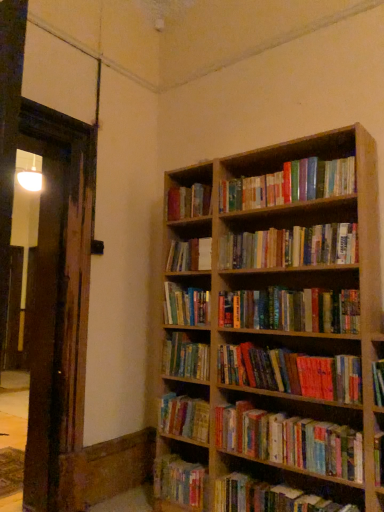
Describe the element at coordinates (185, 357) in the screenshot. This screenshot has height=512, width=384. I see `hardcover books at center, the fifth book positioned from the bottom` at that location.

Where is `hardcover books at center, which is the eighth book from top to bottom`? The width and height of the screenshot is (384, 512). hardcover books at center, which is the eighth book from top to bottom is located at coordinates (185, 357).

What do you see at coordinates (186, 305) in the screenshot?
I see `hardcover book at center, which ranks as the seventh book in bottom-to-top order` at bounding box center [186, 305].

From the picture: Measure the distance between point (282, 488) and camera.

6.74 feet.

Where is `multicolored paperbacks at center, which ranks as the 3th book in bottom-to-top order`? multicolored paperbacks at center, which ranks as the 3th book in bottom-to-top order is located at coordinates (184, 417).

Locate an element on the screen. hardcover books at center, the fifth book positioned from the bottom is located at coordinates (185, 357).

Considering the relative sizes of hardcover book at center, positioned as the 6th book in top-to-bottom order, and hardcover book at lower center, the 12th book when ordered from top to bottom, in the image provided, is hardcover book at center, positioned as the 6th book in top-to-bottom order, thinner than hardcover book at lower center, the 12th book when ordered from top to bottom,?

Yes, hardcover book at center, positioned as the 6th book in top-to-bottom order, is thinner than hardcover book at lower center, the 12th book when ordered from top to bottom.

From the image's perspective, is hardcover book at center, positioned as the 6th book in top-to-bottom order, over hardcover book at lower center, the 12th book when ordered from top to bottom?

Correct, hardcover book at center, positioned as the 6th book in top-to-bottom order, appears higher than hardcover book at lower center, the 12th book when ordered from top to bottom, in the image.

Does hardcover book at center, which ranks as the seventh book in bottom-to-top order, have a larger size compared to hardcover book at lower center, the first book when ordered from bottom to top?

Yes, hardcover book at center, which ranks as the seventh book in bottom-to-top order, is bigger than hardcover book at lower center, the first book when ordered from bottom to top.

Which object is further away from the camera taking this photo, hardcover book at center, which ranks as the seventh book in bottom-to-top order, or hardcover book at lower center, the first book when ordered from bottom to top?

hardcover book at center, which ranks as the seventh book in bottom-to-top order, is more distant.

From a real-world perspective, is multicolored paperbacks at center, which appears as the fourth book when ordered from the bottom, beneath multicolored paperbacks at upper center, the twelfth book in the bottom-to-top sequence?

Yes, from a real-world perspective, multicolored paperbacks at center, which appears as the fourth book when ordered from the bottom, is below multicolored paperbacks at upper center, the twelfth book in the bottom-to-top sequence.

What's the angular difference between multicolored paperbacks at center, the 9th book positioned from the top, and multicolored paperbacks at upper center, which is the first book in top-to-bottom order,'s facing directions?

multicolored paperbacks at center, the 9th book positioned from the top, and multicolored paperbacks at upper center, which is the first book in top-to-bottom order, are facing 0.00344 degrees away from each other.

Does point (276, 461) come closer to viewer compared to point (308, 199)?

Yes, it is in front of point (308, 199).

Could you tell me if multicolored paperbacks at center, which appears as the fourth book when ordered from the bottom, is facing multicolored paperbacks at upper center, which is the first book in top-to-bottom order?

No, multicolored paperbacks at center, which appears as the fourth book when ordered from the bottom, does not turn towards multicolored paperbacks at upper center, which is the first book in top-to-bottom order.

Is hardcover books at center, placed as the fifth book when sorted from top to bottom, next to multicolored paperbacks at center, which ranks as the 3th book in bottom-to-top order, and touching it?

No, hardcover books at center, placed as the fifth book when sorted from top to bottom, is not making contact with multicolored paperbacks at center, which ranks as the 3th book in bottom-to-top order.

The image size is (384, 512). I want to click on the 4th book behind the hardcover books at center, the eighth book when ordered from bottom to top, counting from the anchor's position, so pyautogui.click(x=184, y=417).

Can you confirm if hardcover books at center, placed as the fifth book when sorted from top to bottom, is smaller than multicolored paperbacks at center, which ranks as the 3th book in bottom-to-top order?

No.

In the scene shown: Which object is thinner, hardcover books at center, the eighth book when ordered from bottom to top, or multicolored paperbacks at center, the tenth book from the top?

hardcover books at center, the eighth book when ordered from bottom to top, is thinner.

Does point (230, 205) appear closer or farther from the camera than point (179, 289)?

Point (230, 205).

Considering the relative sizes of multicolored paperbacks at upper center, which is the first book in top-to-bottom order, and hardcover book at center, which ranks as the seventh book in bottom-to-top order, in the image provided, is multicolored paperbacks at upper center, which is the first book in top-to-bottom order, taller than hardcover book at center, which ranks as the seventh book in bottom-to-top order,?

In fact, multicolored paperbacks at upper center, which is the first book in top-to-bottom order, may be shorter than hardcover book at center, which ranks as the seventh book in bottom-to-top order.

Can you confirm if multicolored paperbacks at upper center, which is the first book in top-to-bottom order, is thinner than hardcover book at center, positioned as the 6th book in top-to-bottom order?

Yes, multicolored paperbacks at upper center, which is the first book in top-to-bottom order, is thinner than hardcover book at center, positioned as the 6th book in top-to-bottom order.

Which object is further away from the camera taking this photo, multicolored paperbacks at upper center, which is the first book in top-to-bottom order, or hardcover book at center, positioned as the 6th book in top-to-bottom order?

Positioned behind is hardcover book at center, positioned as the 6th book in top-to-bottom order.

Is hardcover book at center, positioned as the 6th book in top-to-bottom order, to the left or to the right of hardcover books at center, the third book from the top, in the image?

hardcover book at center, positioned as the 6th book in top-to-bottom order, is positioned on hardcover books at center, the third book from the top,'s left side.

From the image's perspective, between hardcover book at center, positioned as the 6th book in top-to-bottom order, and hardcover books at center, which ranks as the tenth book in bottom-to-top order, which one is located above?

hardcover books at center, which ranks as the tenth book in bottom-to-top order.

Which object is closer to the camera taking this photo, hardcover books at center, placed as the fifth book when sorted from top to bottom, or hardcover books at center, the third book from the top?

hardcover books at center, placed as the fifth book when sorted from top to bottom, is in front.

Can you confirm if hardcover books at center, placed as the fifth book when sorted from top to bottom, is wider than hardcover books at center, the third book from the top?

Correct, the width of hardcover books at center, placed as the fifth book when sorted from top to bottom, exceeds that of hardcover books at center, the third book from the top.

From the image's perspective, is hardcover books at center, the eighth book when ordered from bottom to top, on hardcover books at center, the third book from the top?

No, from the image's perspective, hardcover books at center, the eighth book when ordered from bottom to top, is not above hardcover books at center, the third book from the top.

Are hardcover books at center, the eighth book when ordered from bottom to top, and hardcover books at center, which ranks as the tenth book in bottom-to-top order, far apart?

Actually, hardcover books at center, the eighth book when ordered from bottom to top, and hardcover books at center, which ranks as the tenth book in bottom-to-top order, are a little close together.

Does point (223, 416) appear closer or farther from the camera than point (164, 360)?

Clearly, point (223, 416) is closer to the camera than point (164, 360).

Who is taller, multicolored paperbacks at center, which appears as the fourth book when ordered from the bottom, or hardcover books at center, which is the eighth book from top to bottom?

multicolored paperbacks at center, which appears as the fourth book when ordered from the bottom.

Looking at this image, from a real-world perspective, is multicolored paperbacks at center, which appears as the fourth book when ordered from the bottom, positioned above or below hardcover books at center, the fifth book positioned from the bottom?

multicolored paperbacks at center, which appears as the fourth book when ordered from the bottom, is situated lower than hardcover books at center, the fifth book positioned from the bottom, in the real world.

Considering the sizes of multicolored paperbacks at center, the 9th book positioned from the top, and hardcover books at center, which is the eighth book from top to bottom, in the image, is multicolored paperbacks at center, the 9th book positioned from the top, wider or thinner than hardcover books at center, which is the eighth book from top to bottom,?

In the image, multicolored paperbacks at center, the 9th book positioned from the top, appears to be wider than hardcover books at center, which is the eighth book from top to bottom.

From a real-world perspective, count 7th books upward from the hardcover book at lower center, the first book when ordered from bottom to top, and point to it. Please provide its 2D coordinates.

[(186, 305)]

This screenshot has height=512, width=384. I want to click on the 4th book in front when counting from the multicolored paperbacks at upper center, which is the first book in top-to-bottom order, so click(290, 441).

Estimate the real-world distances between objects in this image. Which object is further from multicolored paperbacks at upper center, which is the first book in top-to-bottom order, hardcover book at center, which is the 4th book in top-to-bottom order, or hardcover books at center, placed as the fifth book when sorted from top to bottom?

The object further to multicolored paperbacks at upper center, which is the first book in top-to-bottom order, is hardcover books at center, placed as the fifth book when sorted from top to bottom.

Based on their spatial positions, is hardcover books at upper center, which is counted as the 2th book, starting from the top, or hardcover book at lower right, arranged as the second book when ordered from the bottom, further from multicolored paperbacks at upper center, which is the first book in top-to-bottom order?

hardcover book at lower right, arranged as the second book when ordered from the bottom.

From the picture: Considering their positions, is hardcover books at center, the fifth book positioned from the bottom, positioned closer to multicolored paperbacks at center, the 9th book positioned from the top, than multicolored paperbacks at center, which ranks as the 3th book in bottom-to-top order?

multicolored paperbacks at center, which ranks as the 3th book in bottom-to-top order, is closer to multicolored paperbacks at center, the 9th book positioned from the top.

Estimate the real-world distances between objects in this image. Which object is closer to hardcover book at center, the 9th book from the bottom, multicolored paperbacks at center, which is counted as the 7th book, starting from the top, or hardcover book at lower right, which is the eleventh book in top-to-bottom order?

multicolored paperbacks at center, which is counted as the 7th book, starting from the top.

When comparing their distances from multicolored paperbacks at center, which is counted as the 7th book, starting from the top, does hardcover books at center, the third book from the top, or multicolored paperbacks at center, the tenth book from the top, seem further?

hardcover books at center, the third book from the top.

Considering their positions, is multicolored paperbacks at center, which ranks as the 3th book in bottom-to-top order, positioned closer to hardcover book at lower right, which is the eleventh book in top-to-bottom order, than hardcover books at upper center, acting as the eleventh book starting from the bottom?

Among the two, multicolored paperbacks at center, which ranks as the 3th book in bottom-to-top order, is located nearer to hardcover book at lower right, which is the eleventh book in top-to-bottom order.

Based on their spatial positions, is multicolored paperbacks at center, the tenth book from the top, or multicolored paperbacks at center, which appears as the fourth book when ordered from the bottom, further from hardcover book at center, which ranks as the seventh book in bottom-to-top order?

Among the two, multicolored paperbacks at center, which appears as the fourth book when ordered from the bottom, is located further to hardcover book at center, which ranks as the seventh book in bottom-to-top order.

Estimate the real-world distances between objects in this image. Which object is further from multicolored paperbacks at center, which ranks as the 3th book in bottom-to-top order, multicolored paperbacks at upper center, the twelfth book in the bottom-to-top sequence, or hardcover book at center, the 9th book from the bottom?

multicolored paperbacks at upper center, the twelfth book in the bottom-to-top sequence, is positioned further to the anchor multicolored paperbacks at center, which ranks as the 3th book in bottom-to-top order.